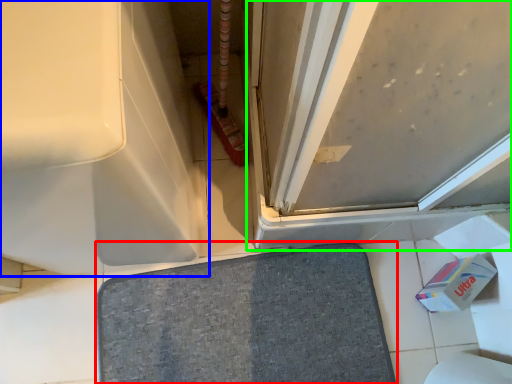
Question: Which is farther away from bath mat (highlighted by a red box)? bath (highlighted by a blue box) or screen door (highlighted by a green box)?

Choices:
 (A) bath
 (B) screen door

Answer: (B)